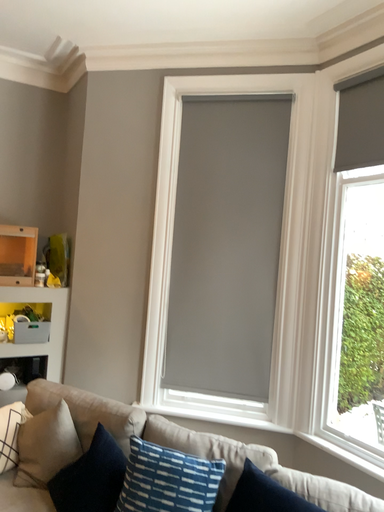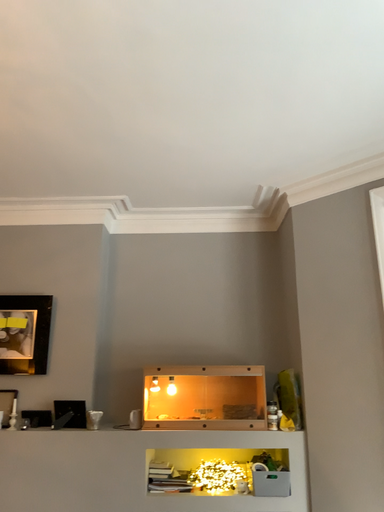
Question: Which way did the camera rotate in the video?

Choices:
 (A) rotated downward
 (B) rotated upward

Answer: (B)